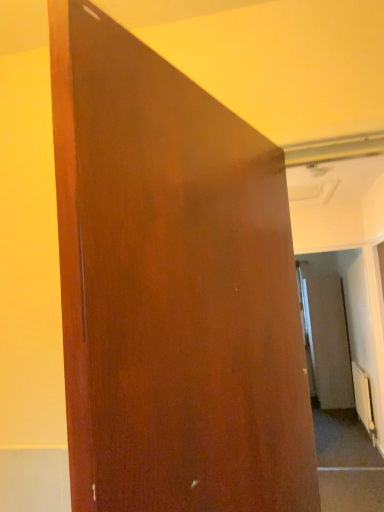
Question: Is matte wood door at center situated inside white metallic radiator at lower right or outside?

Choices:
 (A) inside
 (B) outside

Answer: (B)

Question: In terms of width, does matte wood door at center look wider or thinner when compared to white metallic radiator at lower right?

Choices:
 (A) thin
 (B) wide

Answer: (A)

Question: Which object is positioned closest to the matte brown screen door at right?

Choices:
 (A) matte wood door at center
 (B) white metallic radiator at lower right

Answer: (B)

Question: Which of these objects is positioned closest to the white metallic radiator at lower right?

Choices:
 (A) matte brown screen door at right
 (B) matte wood door at center

Answer: (A)